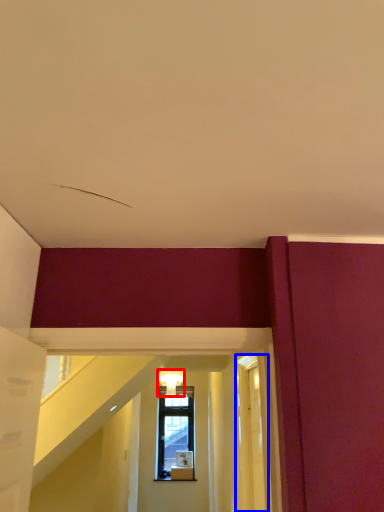
Question: Which of the following is the closest to the observer, light fixture (highlighted by a red box) or glass door (highlighted by a blue box)?

Choices:
 (A) light fixture
 (B) glass door

Answer: (B)